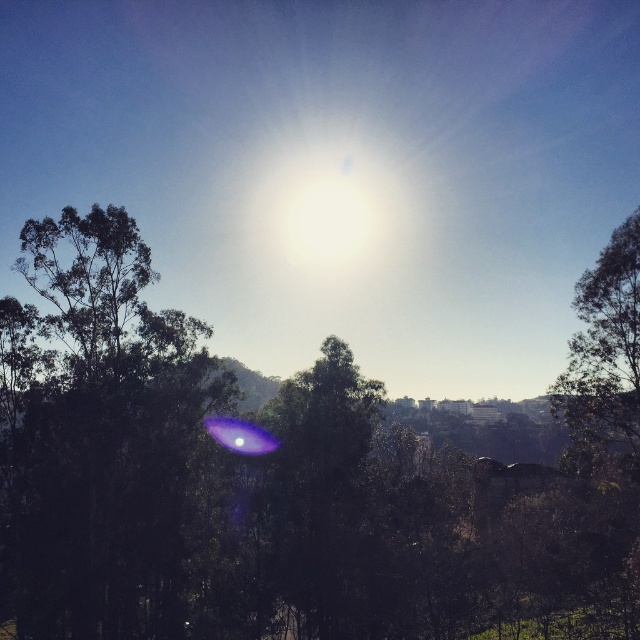
Does green leafy tree at center have a lesser height compared to green leafy tree at right?

No, green leafy tree at center is not shorter than green leafy tree at right.

Is green leafy tree at center positioned behind green leafy tree at right?

No, it is in front of green leafy tree at right.

Is point (134, 477) more distant than point (625, 397)?

Yes, point (134, 477) is behind point (625, 397).

The height and width of the screenshot is (640, 640). Identify the location of green leafy tree at center. (289, 477).

Is green leafy tree at upper left above green leafy tree at right?

No.

Describe the element at coordinates (97, 435) in the screenshot. This screenshot has height=640, width=640. I see `green leafy tree at upper left` at that location.

In order to click on green leafy tree at upper left in this screenshot , I will do `click(97, 435)`.

Which of these two, green leafy tree at center or green leafy tree at upper left, stands shorter?

green leafy tree at upper left is shorter.

Who is lower down, green leafy tree at center or green leafy tree at upper left?

green leafy tree at upper left is below.

Between point (269, 474) and point (20, 516), which one is positioned in front?

Point (20, 516)

Where is `green leafy tree at center`? The width and height of the screenshot is (640, 640). green leafy tree at center is located at coordinates (289, 477).